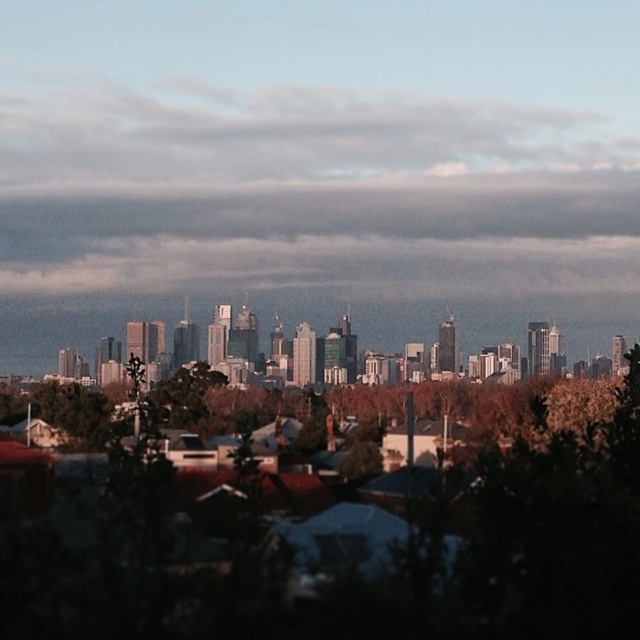
Question: From the image, what is the correct spatial relationship of green leafy tree at center in relation to cloudy sky at upper center?

Choices:
 (A) right
 (B) left

Answer: (A)

Question: Which point appears farthest from the camera in this image?

Choices:
 (A) (269, 577)
 (B) (109, 188)

Answer: (B)

Question: Can you confirm if green leafy tree at center is positioned to the left of cloudy sky at upper center?

Choices:
 (A) no
 (B) yes

Answer: (A)

Question: Which object appears farthest from the camera in this image?

Choices:
 (A) cloudy sky at upper center
 (B) green leafy tree at center

Answer: (A)

Question: Is green leafy tree at center above cloudy sky at upper center?

Choices:
 (A) no
 (B) yes

Answer: (A)